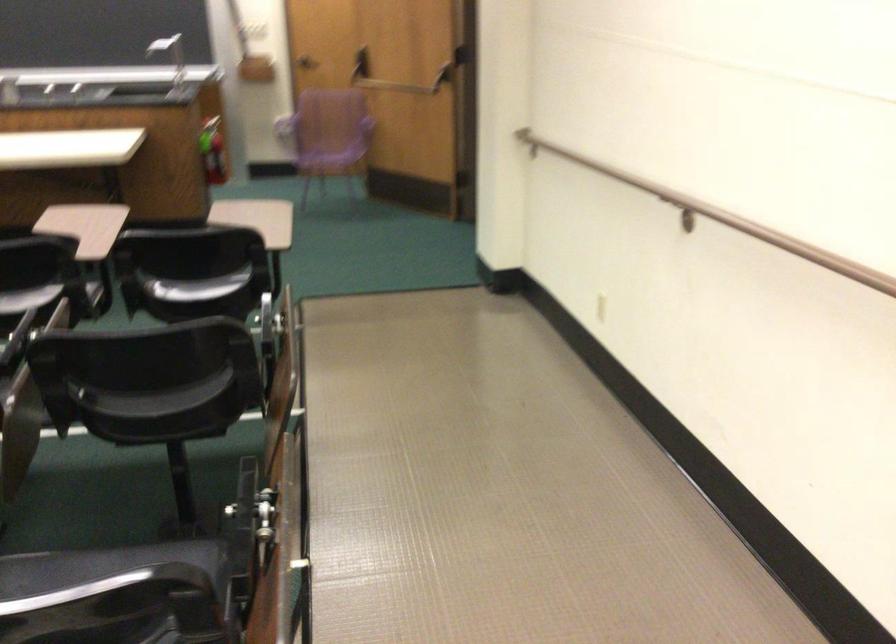
The image size is (896, 644). Identify the location of red fire extinguisher. (212, 151).